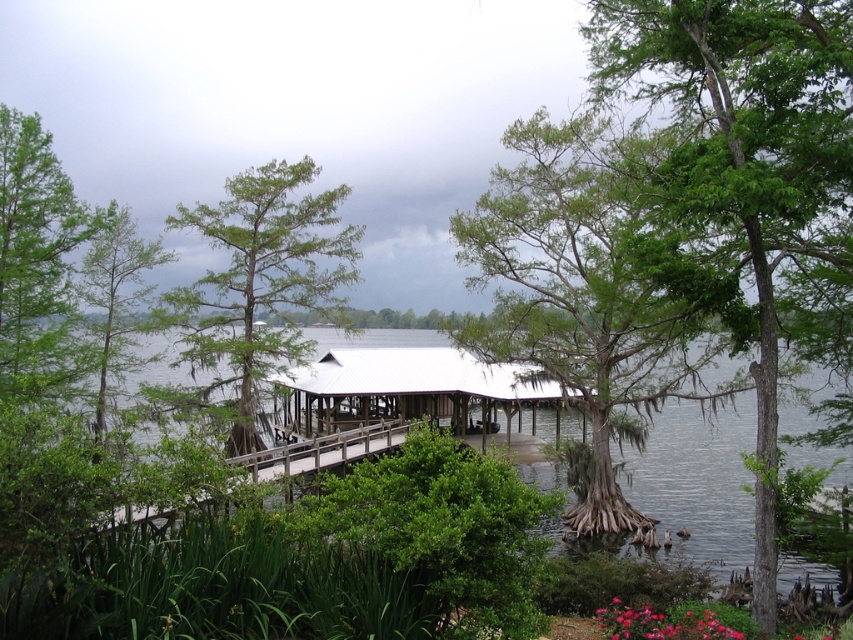
Looking at this image, who is more forward, (256, 333) or (730, 467)?

Point (256, 333) is in front.

Who is positioned more to the left, green matte tree at center or clear water at center?

green matte tree at center is more to the left.

Is point (270, 209) closer to camera compared to point (325, 337)?

Yes, it is in front of point (325, 337).

Image resolution: width=853 pixels, height=640 pixels. Find the location of `green matte tree at center`. green matte tree at center is located at coordinates (260, 280).

Which of these two, green mossy tree at center or green matte tree at left, stands taller?

With more height is green mossy tree at center.

Can you confirm if green mossy tree at center is positioned to the left of green matte tree at left?

Incorrect, green mossy tree at center is not on the left side of green matte tree at left.

Between point (662, 316) and point (119, 256), which one is positioned in front?

Point (662, 316) is in front.

At what (x,y) coordinates should I click in order to perform the action: click on green mossy tree at center. Please return your answer as a coordinate pair (x, y). The image size is (853, 640). Looking at the image, I should click on (579, 301).

Based on the photo, which of these two, green mossy tree at center or white wooden hut at center, stands shorter?

white wooden hut at center

Does green mossy tree at center appear over white wooden hut at center?

Indeed, green mossy tree at center is positioned over white wooden hut at center.

Identify the location of green mossy tree at center. (579, 301).

The height and width of the screenshot is (640, 853). What are the coordinates of `green mossy tree at center` in the screenshot? It's located at (579, 301).